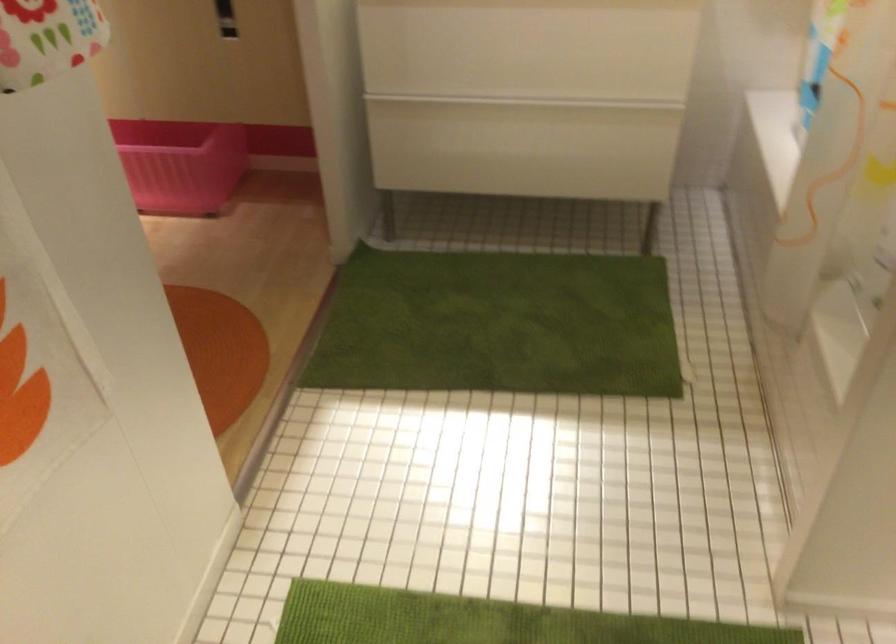
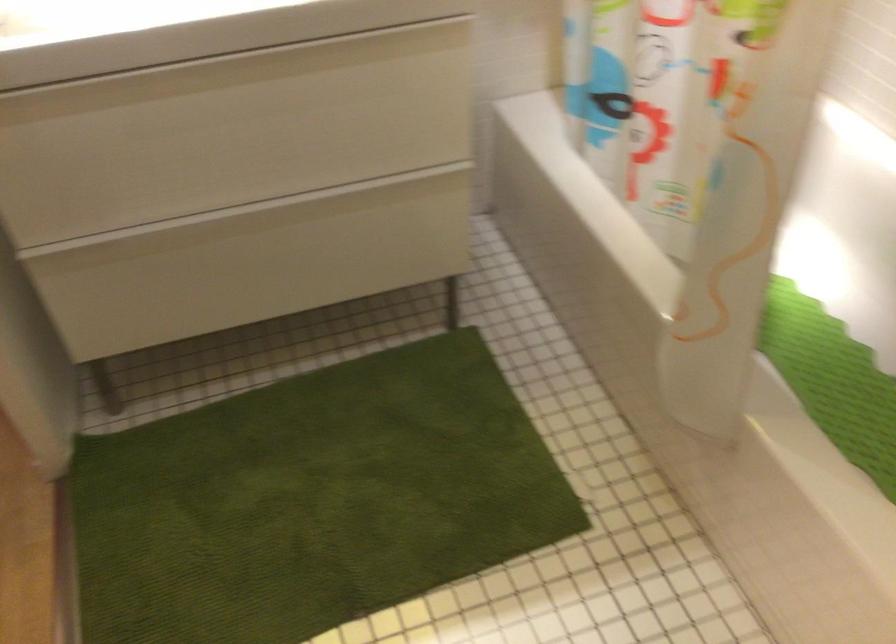
Where in the second image is the point corresponding to (x=533, y=127) from the first image?

(289, 238)